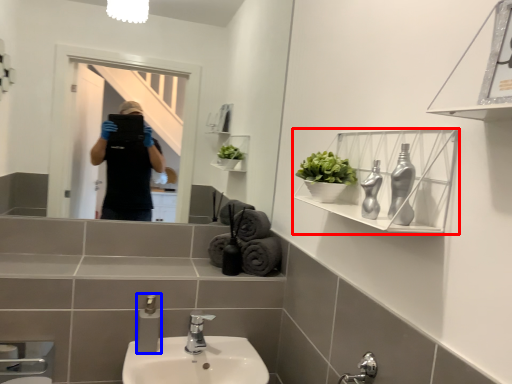
Question: Which point is closer to the camera, shelf (highlighted by a red box) or soap dispenser (highlighted by a blue box)?

Choices:
 (A) shelf
 (B) soap dispenser

Answer: (A)